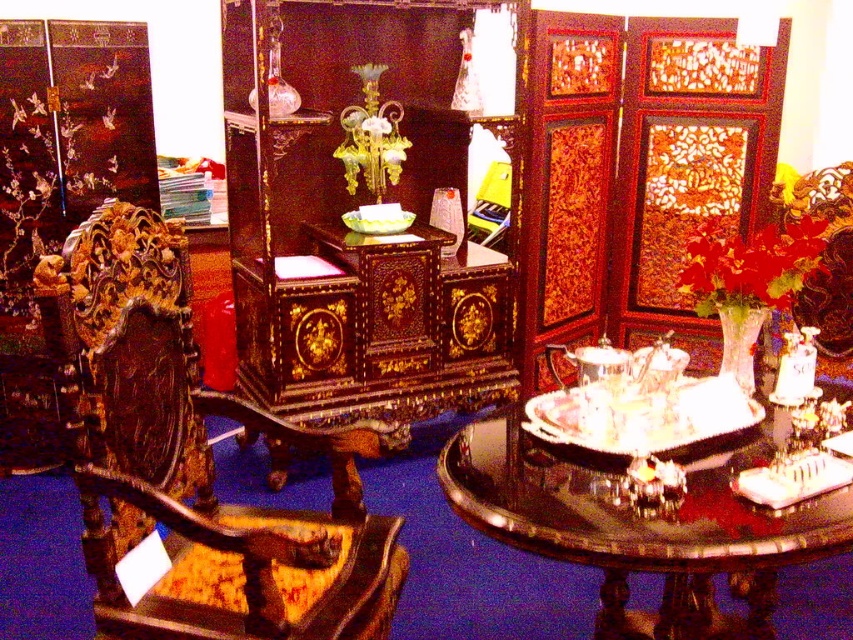
You are standing in the middle of the room and want to place a new decorative item exactly at the point marked as point (x=192, y=458). Which object is already located there?

The polished wood armchair at left is located at point (x=192, y=458).

Based on the photo, you are a customer in the store and want to pick up the glossy wood tray at center. To reach it, you need to walk around the polished wood armchair at left. Which direction should you go around the chair to access the tray?

The glossy wood tray at center is behind the polished wood armchair at left, so you should walk around the back of the polished wood armchair at left to reach the tray.

You are a delivery person who needs to place a package between the polished wood armchair at left and the glossy wood tray at center. The package is 18 inches long. Will it fit in the space between them?

The distance between the polished wood armchair at left and the glossy wood tray at center is 21.08 inches. Since the package is 18 inches long, it will fit in the space between them as there is enough room.